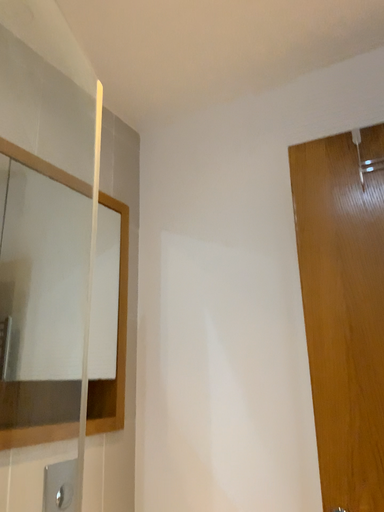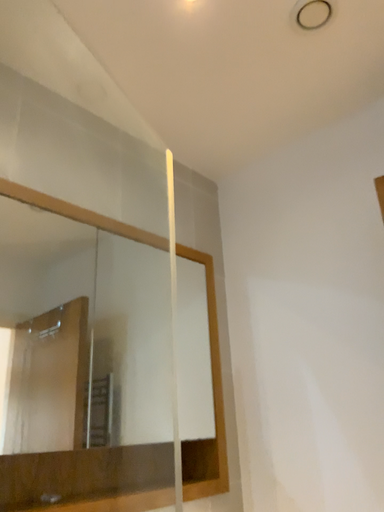
Question: Which way did the camera rotate in the video?

Choices:
 (A) rotated right
 (B) rotated left

Answer: (B)